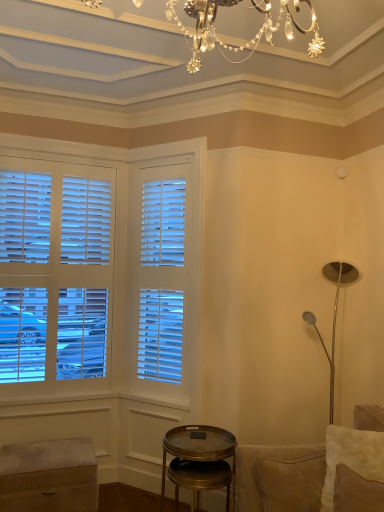
Question: Is metallic gold side table at lower center thinner than suede couch at right?

Choices:
 (A) no
 (B) yes

Answer: (B)

Question: From the image's perspective, is metallic gold side table at lower center on suede couch at right?

Choices:
 (A) no
 (B) yes

Answer: (A)

Question: From a real-world perspective, is metallic gold side table at lower center physically below suede couch at right?

Choices:
 (A) yes
 (B) no

Answer: (A)

Question: Is metallic gold side table at lower center oriented away from suede couch at right?

Choices:
 (A) yes
 (B) no

Answer: (B)

Question: Considering the relative positions of metallic gold side table at lower center and suede couch at right in the image provided, is metallic gold side table at lower center to the right of suede couch at right from the viewer's perspective?

Choices:
 (A) no
 (B) yes

Answer: (A)

Question: Does metallic gold side table at lower center lie in front of suede couch at right?

Choices:
 (A) yes
 (B) no

Answer: (B)

Question: Is suede couch at right at the left side of velvet ottoman at lower left?

Choices:
 (A) no
 (B) yes

Answer: (A)

Question: Can you confirm if suede couch at right is wider than velvet ottoman at lower left?

Choices:
 (A) yes
 (B) no

Answer: (A)

Question: Is suede couch at right next to velvet ottoman at lower left?

Choices:
 (A) yes
 (B) no

Answer: (B)

Question: From a real-world perspective, is suede couch at right on top of velvet ottoman at lower left?

Choices:
 (A) no
 (B) yes

Answer: (B)

Question: Considering the relative sizes of suede couch at right and velvet ottoman at lower left in the image provided, is suede couch at right bigger than velvet ottoman at lower left?

Choices:
 (A) yes
 (B) no

Answer: (A)

Question: Is there a large distance between suede couch at right and velvet ottoman at lower left?

Choices:
 (A) no
 (B) yes

Answer: (B)

Question: From the image's perspective, is suede couch at right below metallic gold side table at lower center?

Choices:
 (A) no
 (B) yes

Answer: (A)